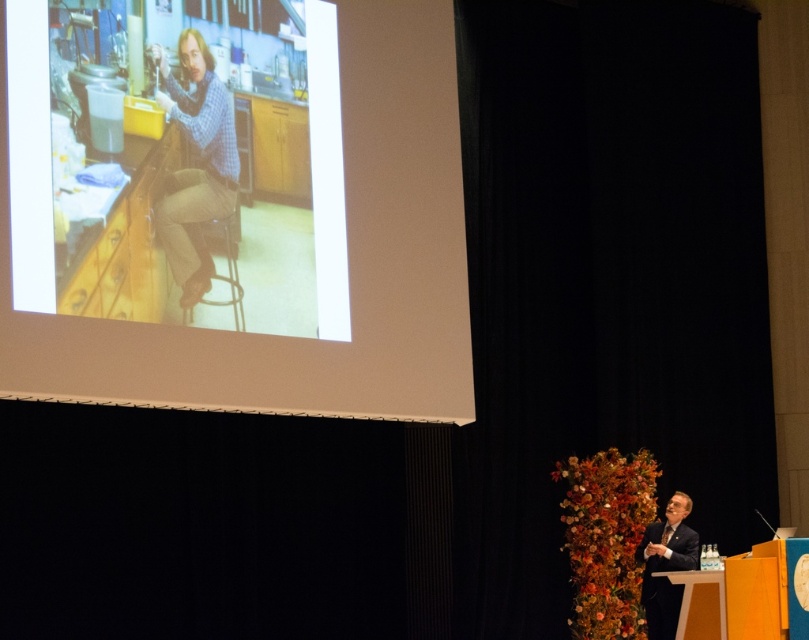
Is white matte projector screen at upper left in front of dark suit at lower right?

No, it is behind dark suit at lower right.

This screenshot has height=640, width=809. Describe the element at coordinates (348, 264) in the screenshot. I see `white matte projector screen at upper left` at that location.

Locate an element on the screen. white matte projector screen at upper left is located at coordinates (348, 264).

Which is more to the left, white matte projector screen at upper left or blue checkered shirt at upper left?

blue checkered shirt at upper left is more to the left.

Is point (422, 380) positioned after point (197, 301)?

Yes, point (422, 380) is behind point (197, 301).

Where is `white matte projector screen at upper left`? white matte projector screen at upper left is located at coordinates point(348,264).

I want to click on white matte projector screen at upper left, so click(348, 264).

Does point (215, 76) come in front of point (668, 509)?

Yes, point (215, 76) is closer to viewer.

Between blue checkered shirt at upper left and dark suit at lower right, which one appears on the right side from the viewer's perspective?

From the viewer's perspective, dark suit at lower right appears more on the right side.

The height and width of the screenshot is (640, 809). Identify the location of blue checkered shirt at upper left. (195, 163).

Locate an element on the screen. This screenshot has height=640, width=809. blue checkered shirt at upper left is located at coordinates (195, 163).